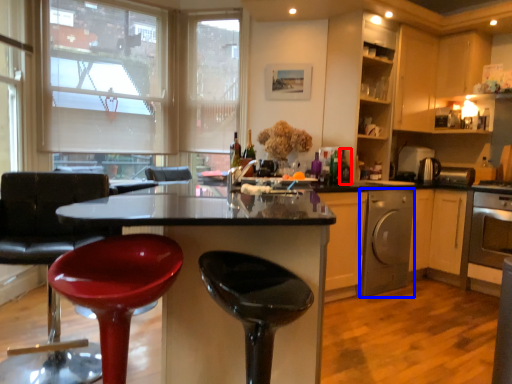
Question: Among these objects, which one is nearest to the camera, bottle (highlighted by a red box) or kitchen appliance (highlighted by a blue box)?

Choices:
 (A) bottle
 (B) kitchen appliance

Answer: (A)